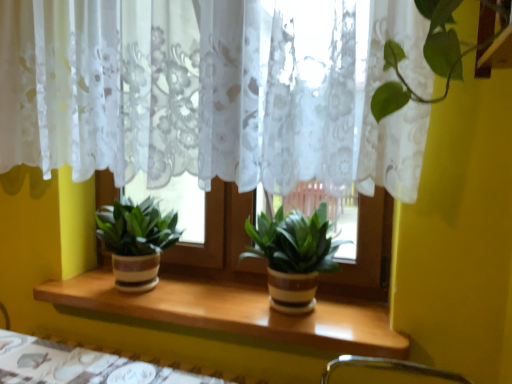
Locate an element on the screen. Image resolution: width=512 pixels, height=384 pixels. empty space that is ontop of wooden at center (from a real-world perspective) is located at coordinates (193, 293).